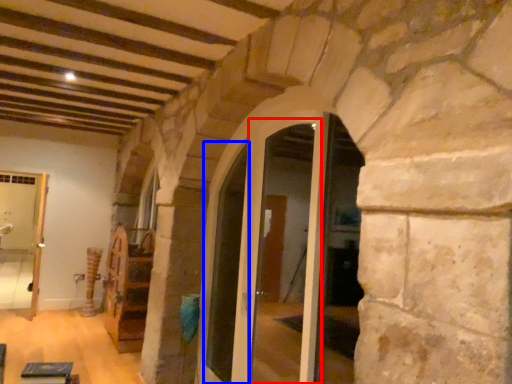
Question: Which point is closer to the camera, glass door (highlighted by a red box) or door (highlighted by a blue box)?

Choices:
 (A) glass door
 (B) door

Answer: (A)